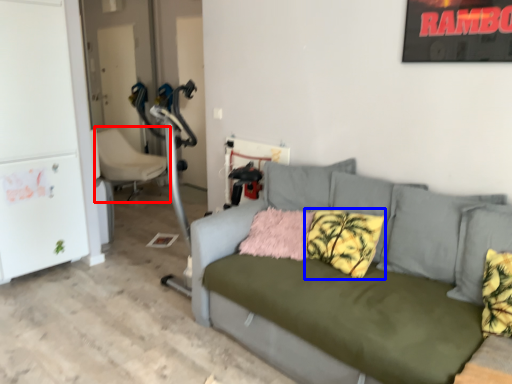
Question: Which object appears closest to the camera in this image, chair (highlighted by a red box) or pillow (highlighted by a blue box)?

Choices:
 (A) chair
 (B) pillow

Answer: (B)